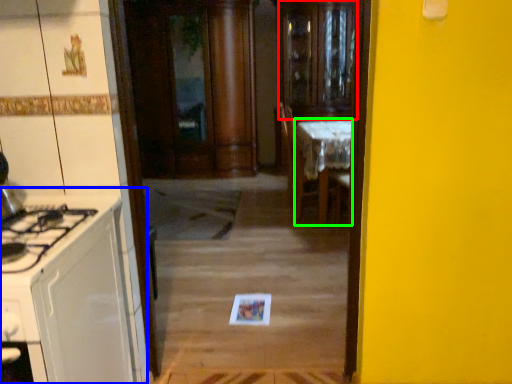
Question: Which object is the farthest from glass door (highlighted by a red box)? Choose among these: cabinetry (highlighted by a blue box) or table (highlighted by a green box).

Choices:
 (A) cabinetry
 (B) table

Answer: (A)